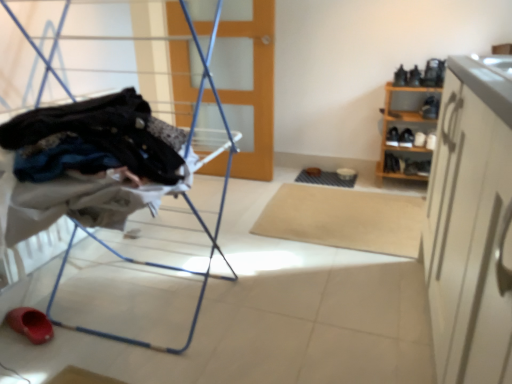
At what (x,y) coordinates should I click in order to perform the action: click on vacant area that lies in front of beige carpet at center. Please return your answer as a coordinate pair (x, y). Looking at the image, I should click on (326, 289).